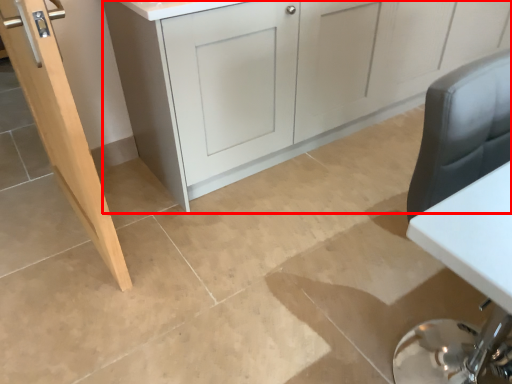
Question: From the image's perspective, considering the relative positions of cabinetry (annotated by the red box) and door in the image provided, where is cabinetry (annotated by the red box) located with respect to the staircase?

Choices:
 (A) below
 (B) above

Answer: (B)